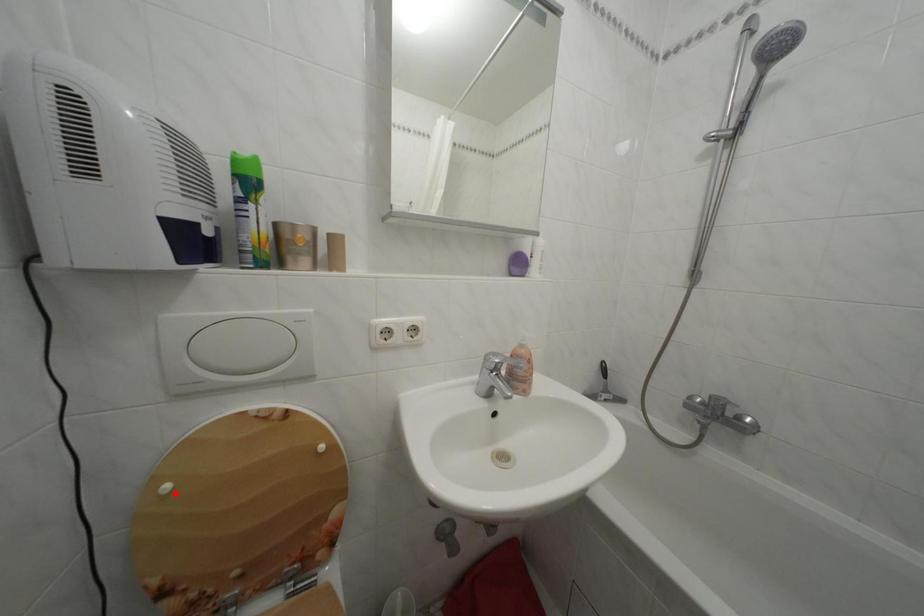
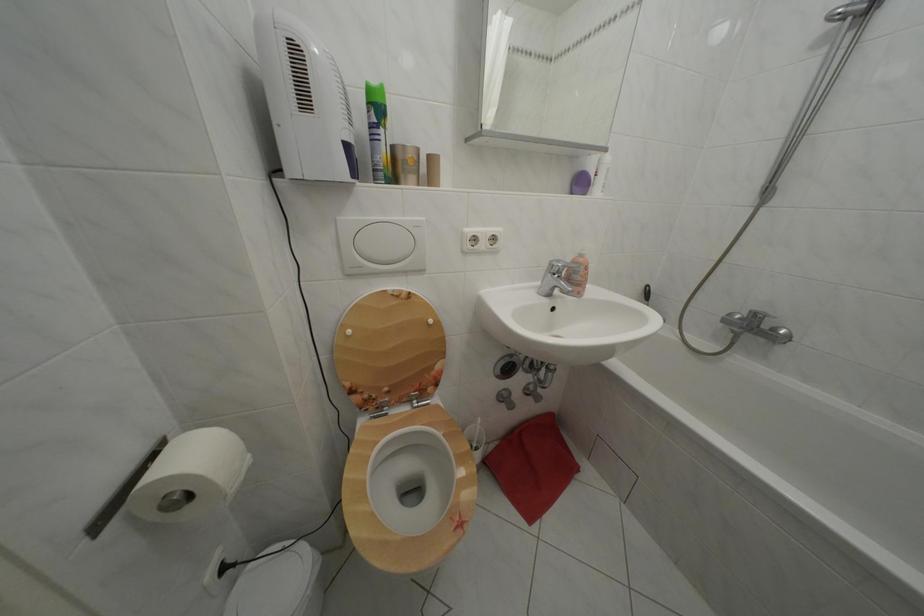
Where in the second image is the point corresponding to the highlighted location from the first image?

(358, 338)